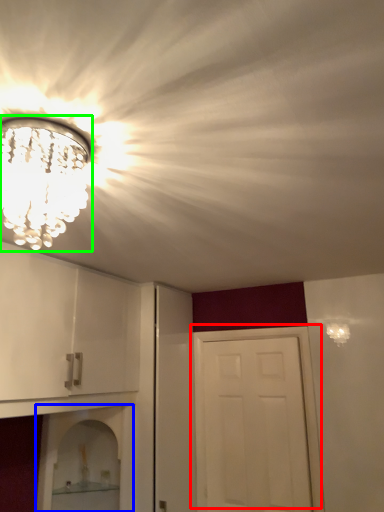
Question: Considering the real-world distances, which object is farthest from door (highlighted by a red box)? shelf (highlighted by a blue box) or light fixture (highlighted by a green box)?

Choices:
 (A) shelf
 (B) light fixture

Answer: (B)